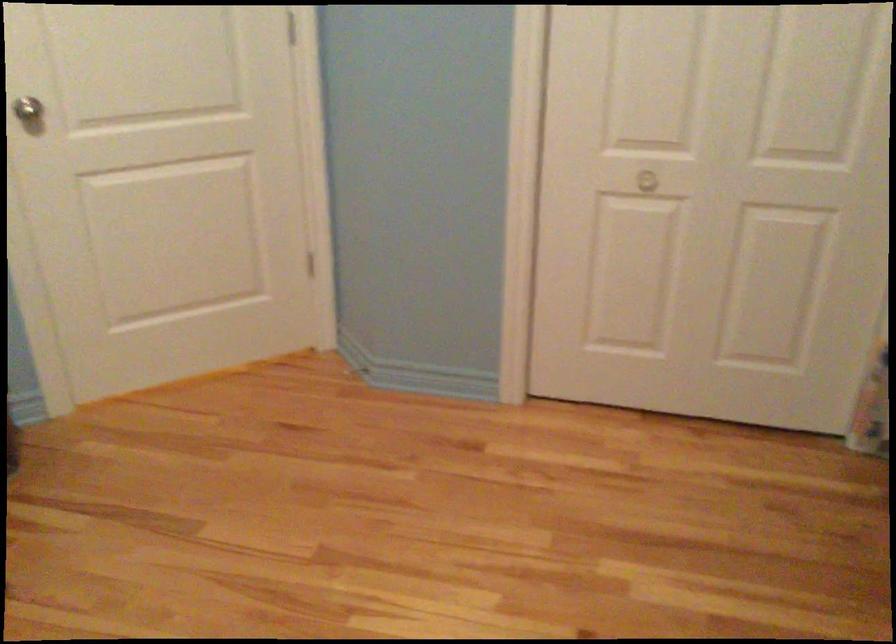
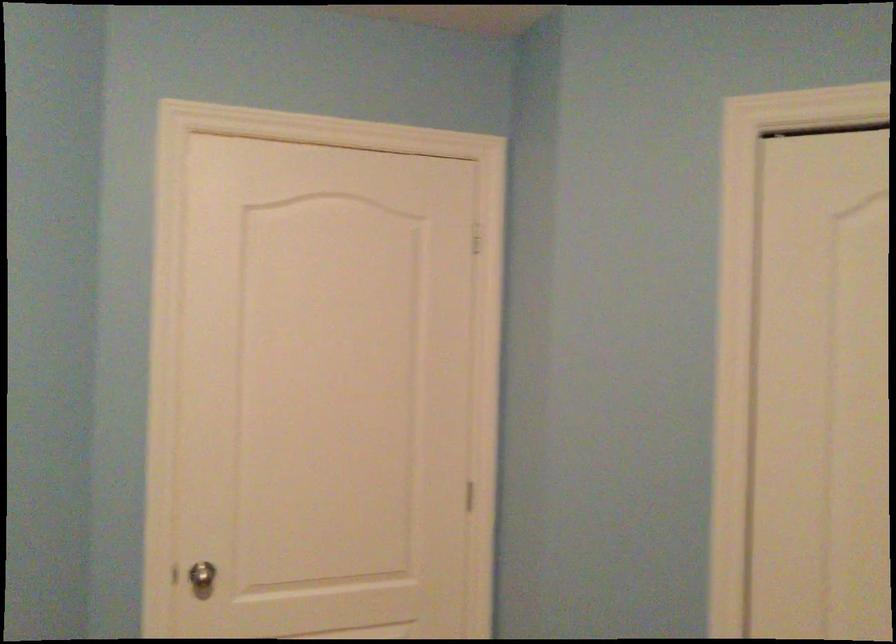
Question: The images are taken continuously from a first-person perspective. In which direction is your viewpoint rotating?

Choices:
 (A) Left
 (B) Right
 (C) Up
 (D) Down

Answer: (C)